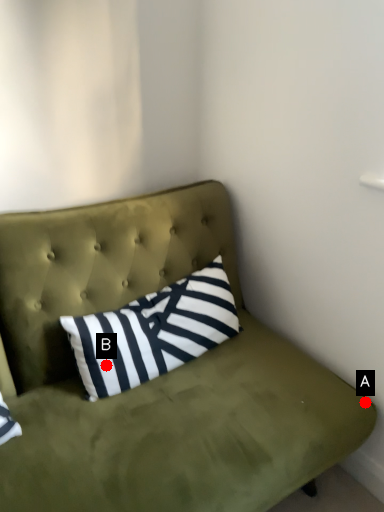
Question: Two points are circled on the image, labeled by A and B beside each circle. Which point is closer to the camera?

Choices:
 (A) A is closer
 (B) B is closer

Answer: (B)